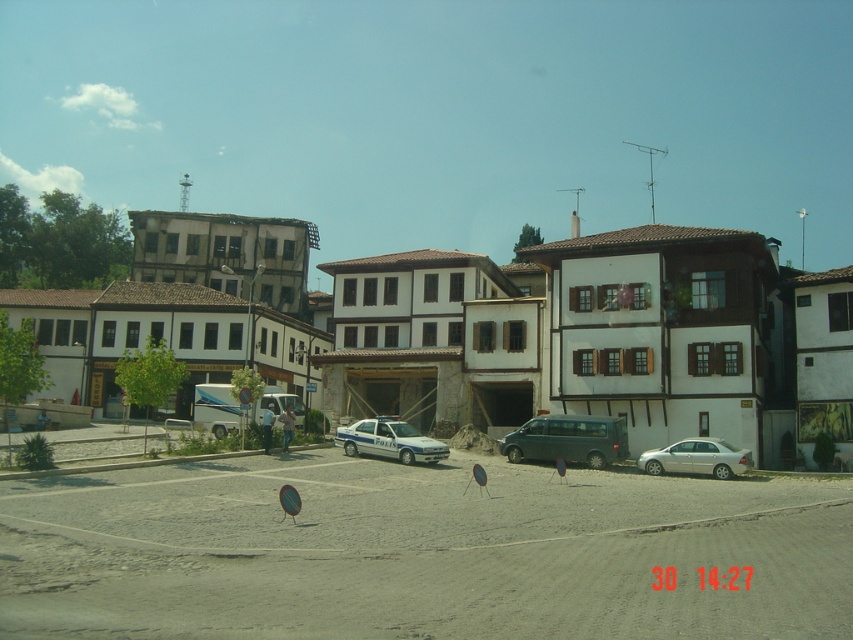
Question: Based on their relative distances, which object is nearer to the smooth asphalt parking lot at center?

Choices:
 (A) silver metallic sedan at lower right
 (B) white painted building at center
 (C) teal matte van at center
 (D) white glossy police car at center

Answer: (D)

Question: Which object is positioned closest to the white painted building at center?

Choices:
 (A) teal matte van at center
 (B) silver metallic sedan at lower right
 (C) white glossy police car at center
 (D) smooth asphalt parking lot at center

Answer: (C)

Question: In this image, where is white painted building at center located relative to teal matte van at center?

Choices:
 (A) left
 (B) right

Answer: (A)

Question: Is white painted building at center smaller than white glossy police car at center?

Choices:
 (A) yes
 (B) no

Answer: (B)

Question: Among these points, which one is nearest to the camera?

Choices:
 (A) (345, 428)
 (B) (560, 435)

Answer: (B)

Question: Does white painted building at center have a larger size compared to white glossy police car at center?

Choices:
 (A) yes
 (B) no

Answer: (A)